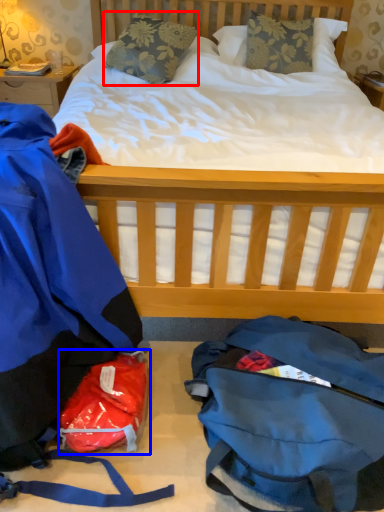
Question: Which object is further to the camera taking this photo, pillow (highlighted by a red box) or diaper bag (highlighted by a blue box)?

Choices:
 (A) pillow
 (B) diaper bag

Answer: (A)